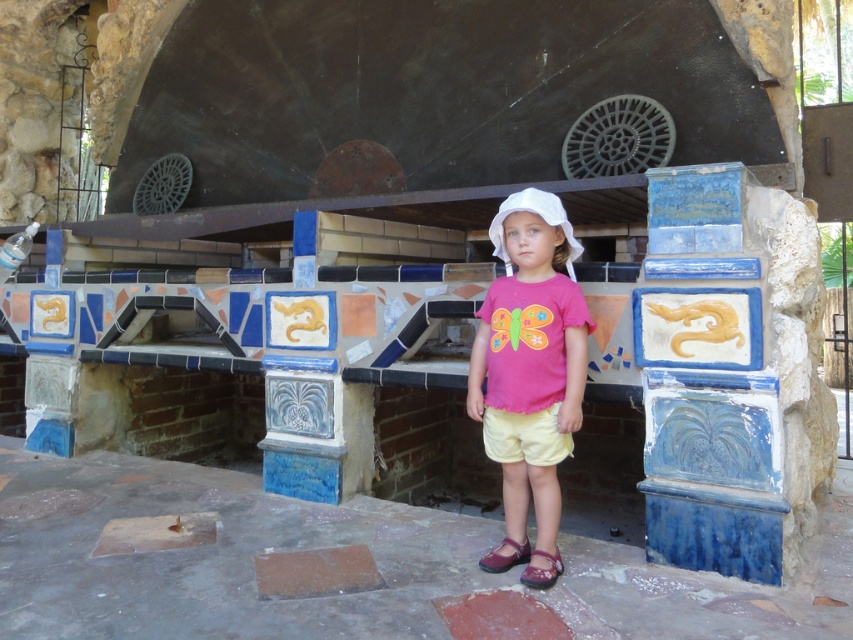
You are a photographer taking a picture of the child in front of the decorative oven. The pink fabric shirt at center and yellow cotton shorts at center are both in the frame. Which clothing item will appear larger in the photo?

The pink fabric shirt at center will appear larger in the photo because it is much taller than the yellow cotton shorts at center.

You are a photographer trying to capture the child in the scene. The pink fabric shirt at center and yellow cotton shorts at center are part of the child. To ensure both the shirt and shorts are in focus, what is the minimum distance you should set your camera lens to focus on?

The pink fabric shirt at center is 6.11 inches away from yellow cotton shorts at center. To ensure both are in focus, the camera lens should be set to focus at a distance that accommodates this separation, typically requiring a depth of field that covers at least 6.11 inches between the shirt and shorts.